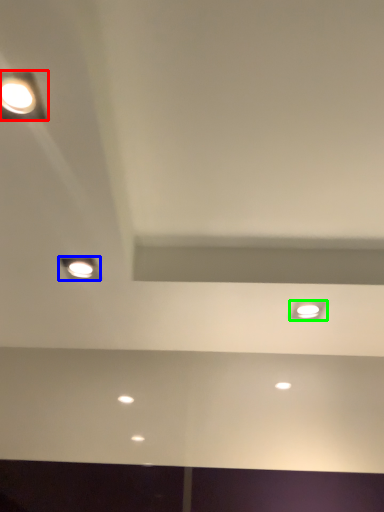
Question: Which is nearer to the lamp (highlighted by a red box)? lamp (highlighted by a blue box) or dot (highlighted by a green box).

Choices:
 (A) lamp
 (B) dot

Answer: (A)